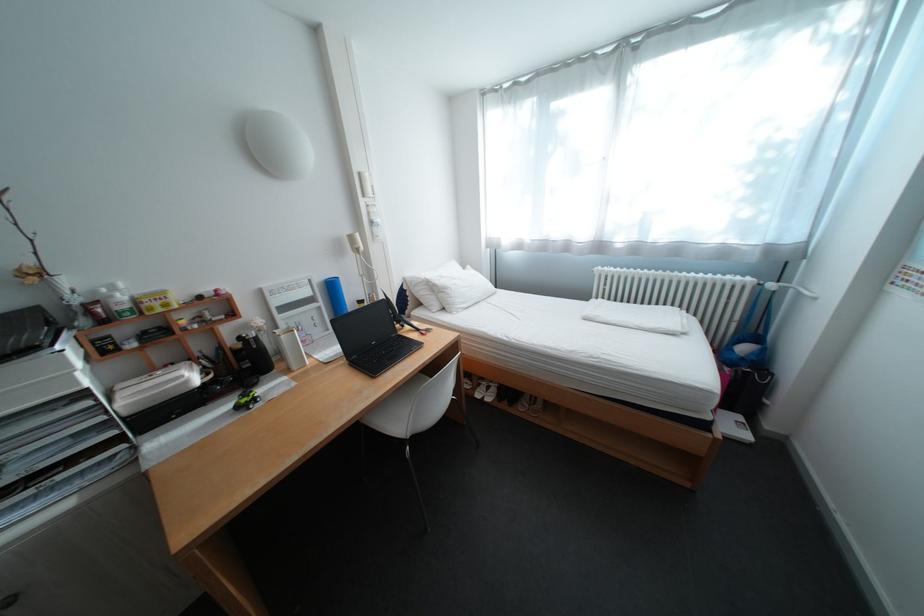
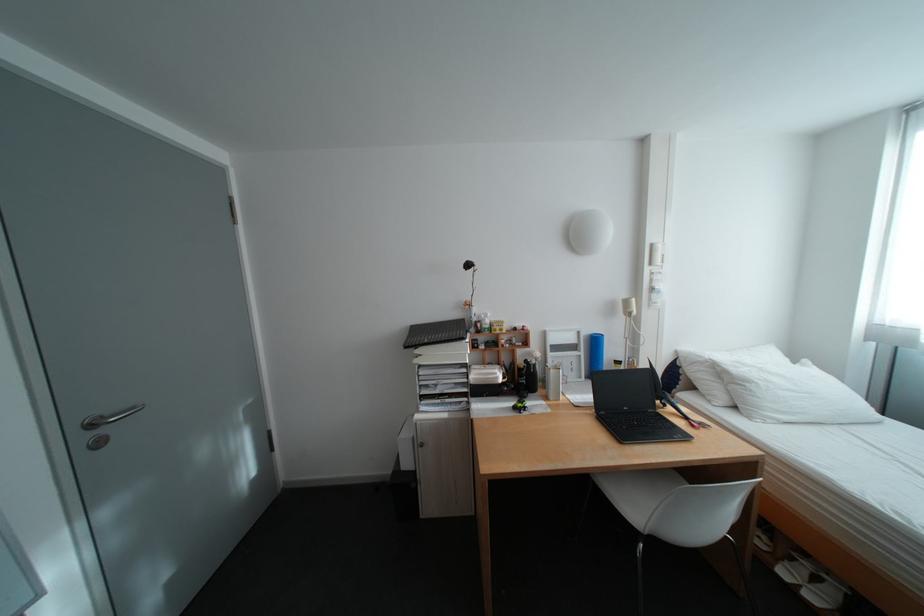
Where in the second image is the point corresponding to point (274, 325) from the first image?

(552, 358)